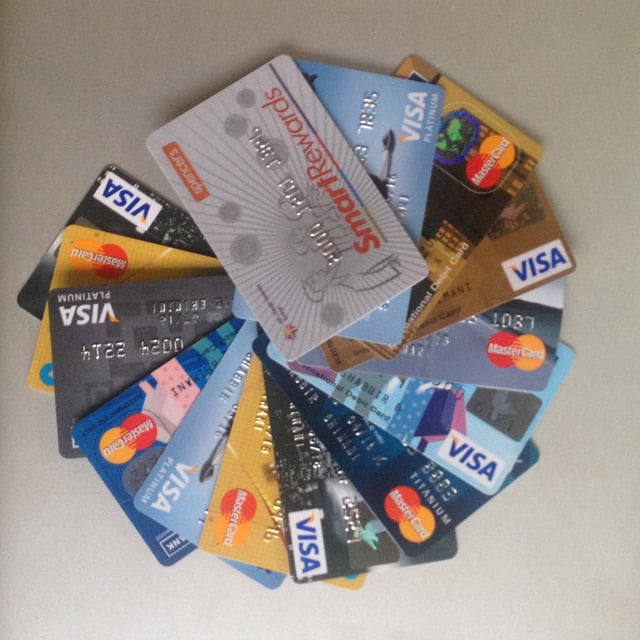
Find the location of a particular element. The width and height of the screenshot is (640, 640). table is located at coordinates (499, 570).